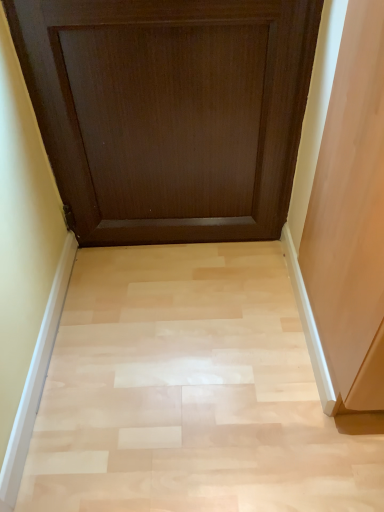
Question: From the image's perspective, is light wood floor at center below dark wood door at upper center?

Choices:
 (A) no
 (B) yes

Answer: (B)

Question: From a real-world perspective, does light wood floor at center stand above dark wood door at upper center?

Choices:
 (A) no
 (B) yes

Answer: (A)

Question: Is the depth of light wood floor at center less than that of dark wood door at upper center?

Choices:
 (A) no
 (B) yes

Answer: (A)

Question: Is light wood floor at center far from dark wood door at upper center?

Choices:
 (A) yes
 (B) no

Answer: (B)

Question: Could dark wood door at upper center be considered to be inside light wood floor at center?

Choices:
 (A) yes
 (B) no

Answer: (B)

Question: From a real-world perspective, is light wood floor at center under dark wood door at upper center?

Choices:
 (A) no
 (B) yes

Answer: (B)

Question: Is dark wood door at upper center not near light wood floor at center?

Choices:
 (A) yes
 (B) no

Answer: (B)

Question: Is dark wood door at upper center positioned before light wood floor at center?

Choices:
 (A) no
 (B) yes

Answer: (B)

Question: Considering the relative sizes of dark wood door at upper center and light wood floor at center in the image provided, is dark wood door at upper center thinner than light wood floor at center?

Choices:
 (A) no
 (B) yes

Answer: (B)

Question: From a real-world perspective, is dark wood door at upper center on top of light wood floor at center?

Choices:
 (A) yes
 (B) no

Answer: (A)

Question: Is dark wood door at upper center bigger than light wood floor at center?

Choices:
 (A) yes
 (B) no

Answer: (A)

Question: Considering the relative positions of dark wood door at upper center and light wood floor at center in the image provided, is dark wood door at upper center to the right of light wood floor at center from the viewer's perspective?

Choices:
 (A) no
 (B) yes

Answer: (A)

Question: Relative to light wood floor at center, is dark wood door at upper center in front or behind?

Choices:
 (A) behind
 (B) front

Answer: (B)